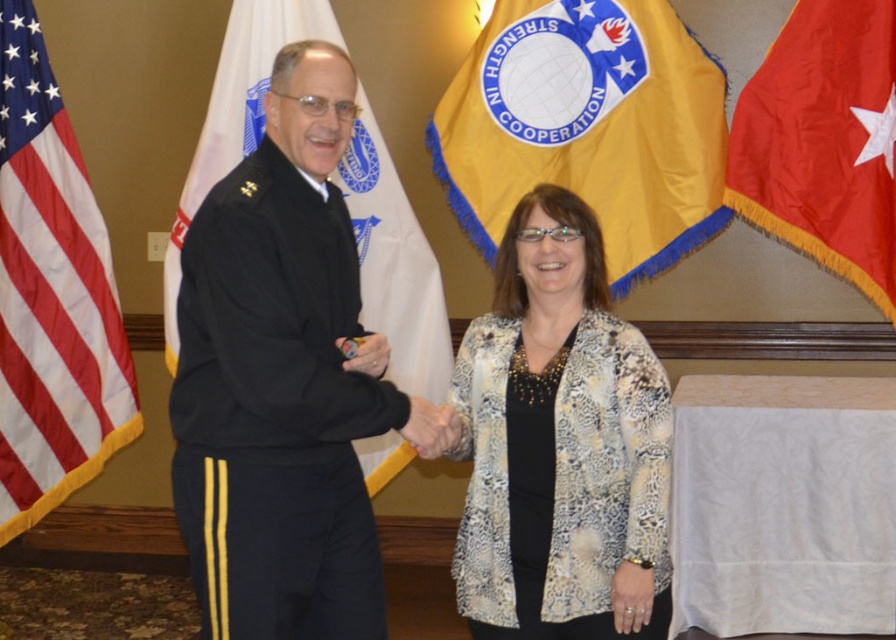
You are an event organizer planning to hang decorations between the printed fabric jacket at center and the black fabric flag at left. Given their sizes, which object should you place closer to the center of the room to ensure the decorations are balanced?

The printed fabric jacket at center has a larger width than the black fabric flag at left, so placing it closer to the center of the room would balance the decorations by compensating for its greater size.

What is the color of the fabric located at the coordinates specified by point (50,296)?

The fabric at point (50,296) is red and white striped.